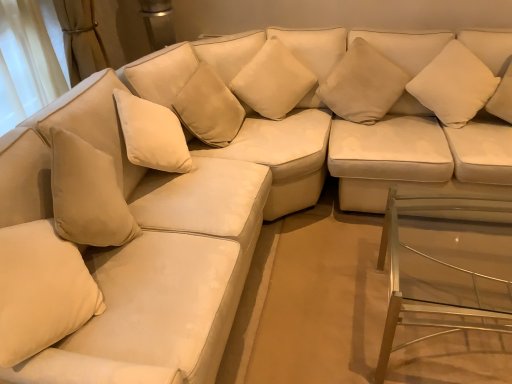
Question: Is there a large distance between beige fabric pillow at upper center, which is the second pillow from right to left, and suede-like beige pillow at center, which ranks as the second pillow in left-to-right order?

Choices:
 (A) no
 (B) yes

Answer: (A)

Question: Does beige fabric pillow at upper center, positioned as the 3th pillow in left-to-right order, have a lesser height compared to suede-like beige pillow at center, which ranks as the second pillow in left-to-right order?

Choices:
 (A) yes
 (B) no

Answer: (A)

Question: Is beige fabric pillow at upper center, positioned as the 3th pillow in left-to-right order, looking in the opposite direction of suede-like beige pillow at center, which ranks as the second pillow in left-to-right order?

Choices:
 (A) yes
 (B) no

Answer: (B)

Question: Are beige fabric pillow at upper center, which is the second pillow from right to left, and suede-like beige pillow at center, positioned as the 3th pillow in right-to-left order, beside each other?

Choices:
 (A) yes
 (B) no

Answer: (B)

Question: Considering the relative positions of beige fabric pillow at upper center, which is the second pillow from right to left, and suede-like beige pillow at center, which ranks as the second pillow in left-to-right order, in the image provided, is beige fabric pillow at upper center, which is the second pillow from right to left, behind suede-like beige pillow at center, which ranks as the second pillow in left-to-right order,?

Choices:
 (A) no
 (B) yes

Answer: (B)

Question: Does beige fabric pillow at upper center, positioned as the 3th pillow in left-to-right order, have a greater width compared to suede-like beige pillow at center, which ranks as the second pillow in left-to-right order?

Choices:
 (A) no
 (B) yes

Answer: (B)

Question: Does suede-like beige pillow at center, positioned as the 3th pillow in right-to-left order, have a lesser width compared to clear glass table at lower right?

Choices:
 (A) no
 (B) yes

Answer: (B)

Question: Does suede-like beige pillow at center, which ranks as the second pillow in left-to-right order, have a smaller size compared to clear glass table at lower right?

Choices:
 (A) no
 (B) yes

Answer: (B)

Question: Is clear glass table at lower right at the back of suede-like beige pillow at center, which ranks as the second pillow in left-to-right order?

Choices:
 (A) no
 (B) yes

Answer: (A)

Question: From the image's perspective, is suede-like beige pillow at center, positioned as the 3th pillow in right-to-left order, located above clear glass table at lower right?

Choices:
 (A) yes
 (B) no

Answer: (A)

Question: Can you confirm if suede-like beige pillow at center, positioned as the 3th pillow in right-to-left order, is wider than clear glass table at lower right?

Choices:
 (A) no
 (B) yes

Answer: (A)

Question: Could you tell me if suede-like beige pillow at center, which ranks as the second pillow in left-to-right order, is facing clear glass table at lower right?

Choices:
 (A) yes
 (B) no

Answer: (A)

Question: Does beige fabric pillow at lower left, marked as the first pillow in a left-to-right arrangement, have a lesser width compared to clear glass table at lower right?

Choices:
 (A) yes
 (B) no

Answer: (A)